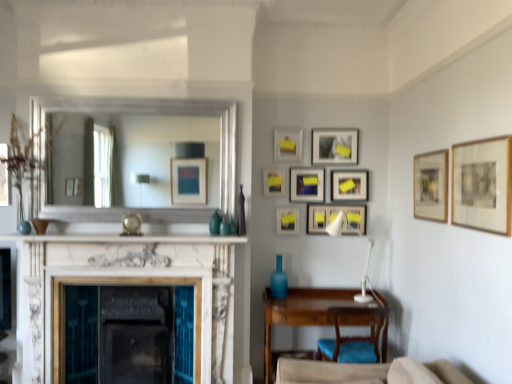
Question: From a real-world perspective, is blue fabric chair at lower right positioned above or below white marble fireplace at center?

Choices:
 (A) above
 (B) below

Answer: (B)

Question: From the image's perspective, is blue fabric chair at lower right above or below white marble fireplace at center?

Choices:
 (A) below
 (B) above

Answer: (A)

Question: Which object is positioned closest to the matte wooden picture frame at center, the 4th picture frame from the front?

Choices:
 (A) wooden desk at lower right
 (B) matte black picture frame at center-right, placed as the seventh picture frame when sorted from front to back
 (C) white plastic lamp at center-right
 (D) matte black picture frame at upper center, the sixth picture frame when ordered from front to back
 (E) matte black picture frame at center, positioned as the 9th picture frame in front-to-back order

Answer: (E)

Question: Estimate the real-world distances between objects in this image. Which object is closer to the matte black picture frame at center, positioned as the 9th picture frame in front-to-back order?

Choices:
 (A) blue fabric chair at lower right
 (B) matte black picture frame at center, which is the 2th picture frame from back to front
 (C) white plastic lamp at center-right
 (D) matte wooden picture frame at center, the 4th picture frame from the front
 (E) silver/metallic mirror at upper center

Answer: (B)